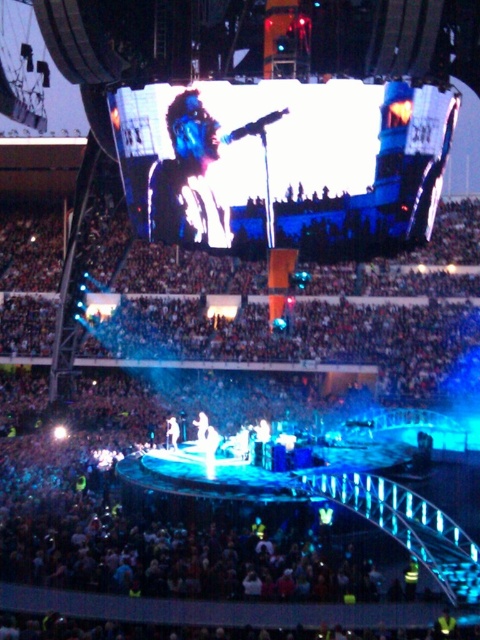
You are a photographer at the concert and want to capture both the matte black face at upper center and the shiny silver microphone at center in a single shot. Which object should you focus on first to ensure both are in frame?

The matte black face at upper center is larger than the shiny silver microphone at center, so focusing on the matte black face at upper center first will help ensure both fit within the frame.